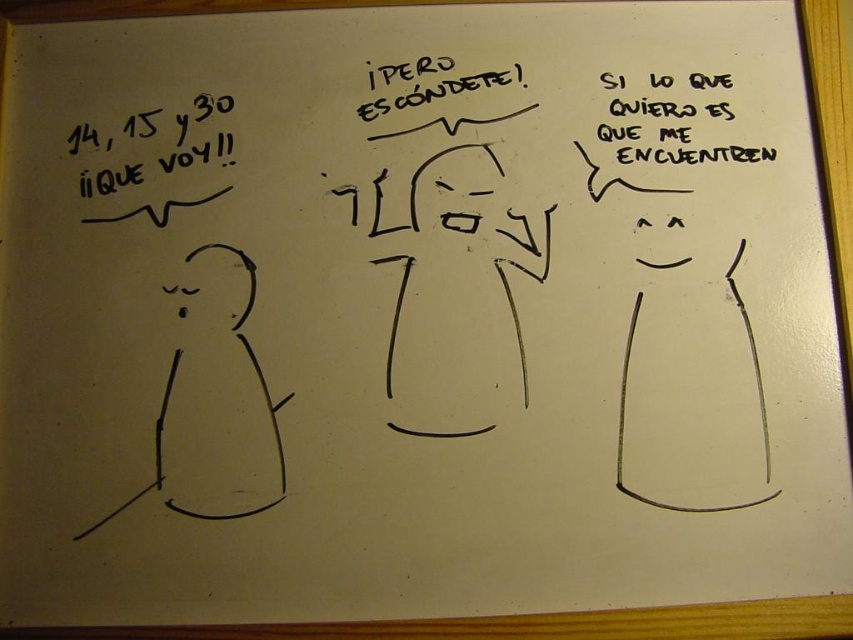
You are an art student who wants to hang a small picture frame between the black paper text at upper right and the black marker text at center on the whiteboard. The frame is 6 inches wide. Will it fit without overlapping either text?

The distance between the black paper text at upper right and black marker text at center is 7.79 inches. Since the frame is 6 inches wide, it will fit as 6 is less than 7.79.

You are standing in front of the whiteboard and see two points marked on it. The first point is at coordinates point (x=740, y=150) and the second is at point (x=398, y=108). Which point is closer to you?

Point (x=740, y=150) is in front of point (x=398, y=108), so the first point is closer to you.